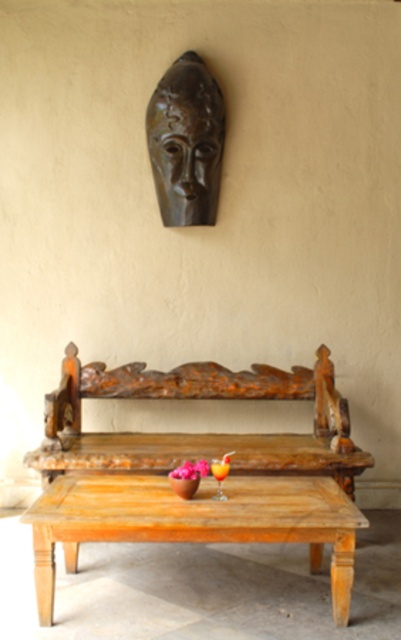
What do you see at coordinates (198, 433) in the screenshot? I see `wooden carved bench at center` at bounding box center [198, 433].

Which is behind, point (164, 384) or point (129, 532)?

The point (164, 384) is more distant.

Find the location of a particular element. This screenshot has height=640, width=401. wooden carved bench at center is located at coordinates (198, 433).

Is point (322, 529) closer to camera compared to point (186, 67)?

That is True.

Between wooden table at center and brown polished wood mask at upper center, which one has more height?

brown polished wood mask at upper center

Locate an element on the screen. This screenshot has height=640, width=401. wooden table at center is located at coordinates (194, 520).

Does wooden table at center appear over matte pink flower at center?

Incorrect, wooden table at center is not positioned above matte pink flower at center.

Does wooden table at center have a larger size compared to matte pink flower at center?

Yes, wooden table at center is bigger than matte pink flower at center.

Who is more distant from viewer, (350, 532) or (174, 470)?

Point (174, 470)

The image size is (401, 640). In order to click on wooden table at center in this screenshot , I will do `click(194, 520)`.